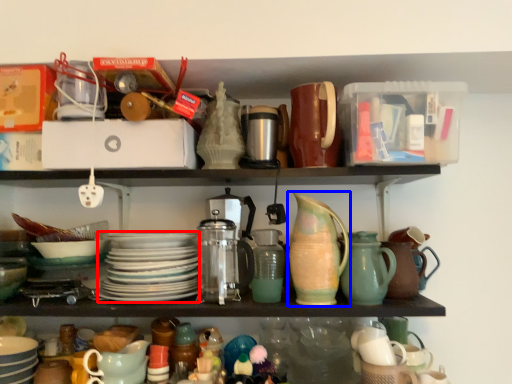
Question: Which object appears closest to the camera in this image, platter (highlighted by a red box) or jug (highlighted by a blue box)?

Choices:
 (A) platter
 (B) jug

Answer: (B)